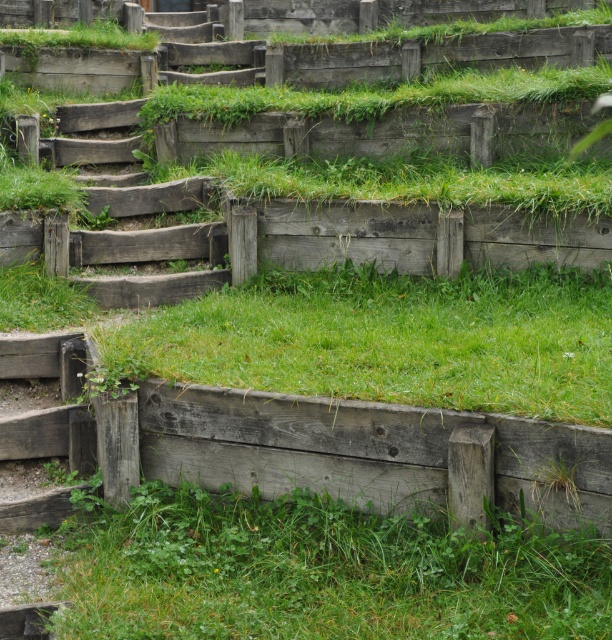
At what (x,y) coordinates should I click in order to perform the action: click on green grassy at center. Please return your answer as a coordinate pair (x, y). This screenshot has width=612, height=640. Looking at the image, I should click on (389, 339).

Can you confirm if green grassy at center is taller than weathered wood stairs at center?

Yes.

Find the location of a particular element. green grassy at center is located at coordinates (389, 339).

Where is `green grassy at center`? green grassy at center is located at coordinates (389, 339).

Is point (146, 579) positioned behind point (146, 196)?

No, it is not.

In the scene shown: Is green grassy at lower center bigger than weathered wood stairs at center?

Correct, green grassy at lower center is larger in size than weathered wood stairs at center.

Between point (217, 570) and point (187, 244), which one is positioned behind?

The point (187, 244) is more distant.

The image size is (612, 640). I want to click on green grassy at lower center, so pos(321,572).

Can you confirm if green grassy at lower center is thinner than green grassy at center?

Indeed, green grassy at lower center has a lesser width compared to green grassy at center.

Locate an element on the screen. The image size is (612, 640). green grassy at lower center is located at coordinates (321, 572).